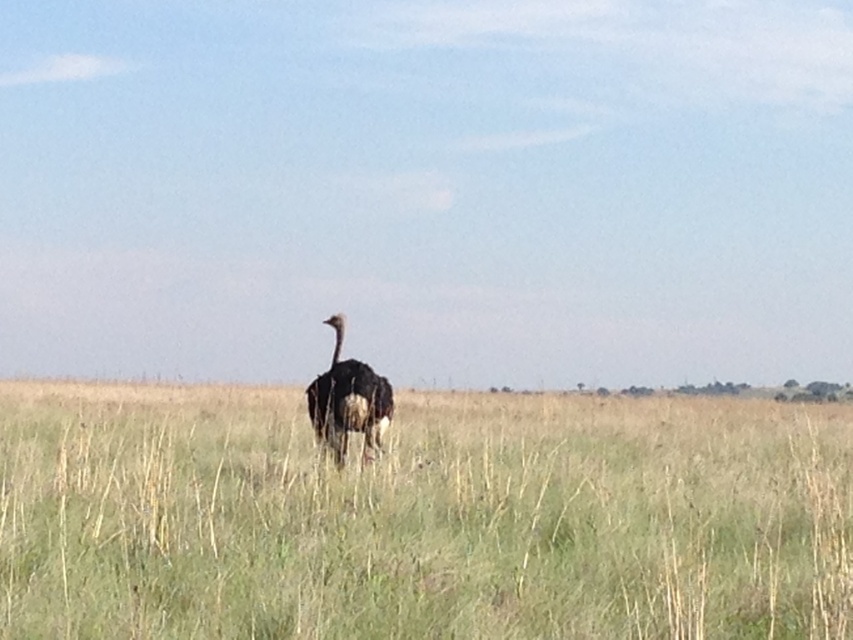
You are standing in the savanna and want to find the green grass at center. According to the coordinates provided, where should you look relative to the ostrich walking away from the camera?

The green grass at center is located at point 0.809 on the x axis and 0.495 on the y axis. Since the ostrich is in the middle ground, the green grass at center is positioned to the right and slightly below the ostrich.

You are a photographer aiming to capture the ostrich in the savanna. You notice the green grass at center and the dark brown feathers at center. Which object is taller in the scene?

The dark brown feathers at center are taller than the green grass at center.